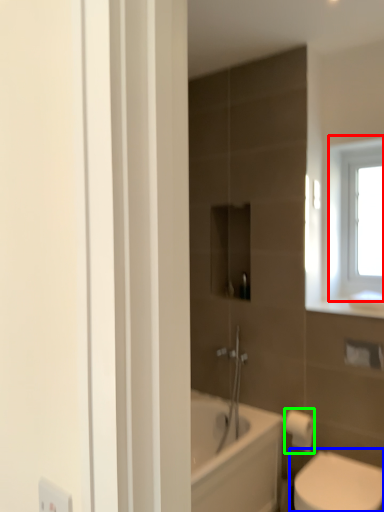
Question: Considering the real-world distances, which object is farthest from window (highlighted by a red box)? toilet (highlighted by a blue box) or toilet paper (highlighted by a green box)?

Choices:
 (A) toilet
 (B) toilet paper

Answer: (A)